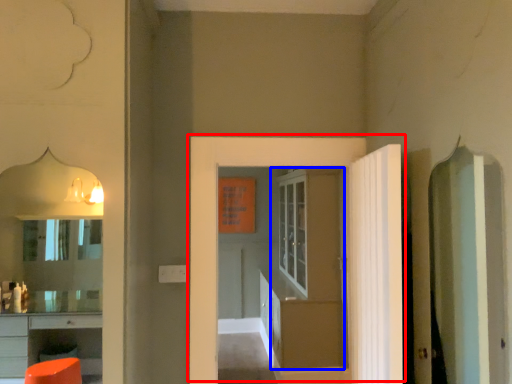
Question: Which of the following is the closest to the observer, door (highlighted by a red box) or door (highlighted by a blue box)?

Choices:
 (A) door
 (B) door

Answer: (A)